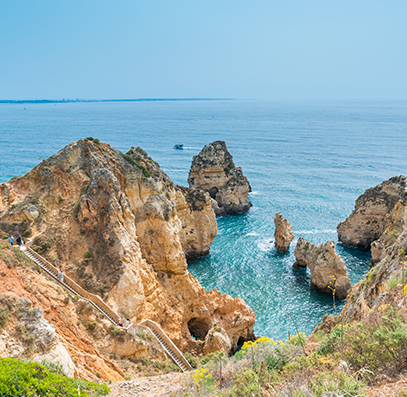
The height and width of the screenshot is (397, 407). What are the coordinates of `stairs` in the screenshot? It's located at (170, 352), (163, 339).